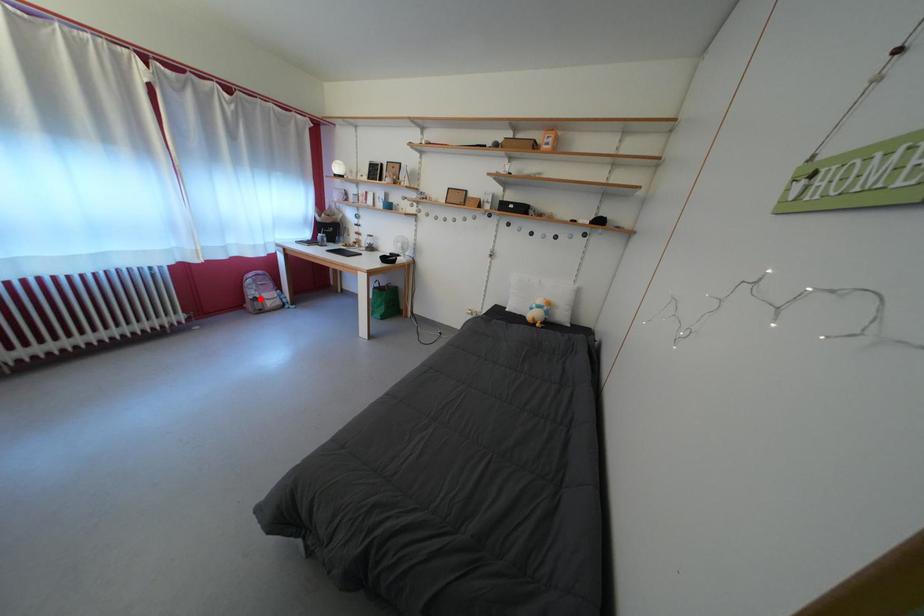
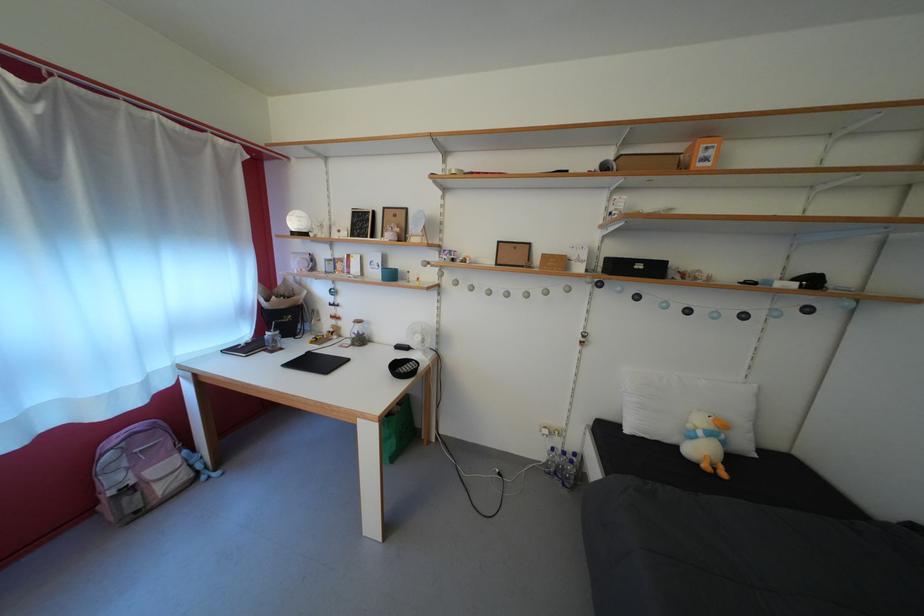
In the second image, find the point that corresponds to the highlighted location in the first image.

(123, 485)